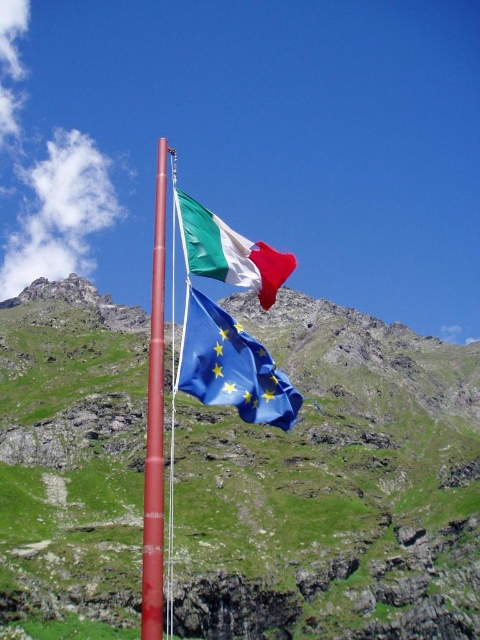
Question: Which point is closer to the camera?

Choices:
 (A) blue fabric flag at upper center
 (B) matte fabric flag at upper center
 (C) smooth red pole at center
 (D) green grassy mountain at upper center

Answer: (C)

Question: Is green grassy mountain at upper center closer to camera compared to smooth red pole at center?

Choices:
 (A) yes
 (B) no

Answer: (B)

Question: Which of these objects is positioned farthest from the smooth red pole at center?

Choices:
 (A) matte fabric flag at upper center
 (B) green grassy mountain at upper center

Answer: (B)

Question: Which point is closer to the camera?

Choices:
 (A) green grassy mountain at upper center
 (B) matte fabric flag at upper center
 (C) smooth red pole at center

Answer: (C)

Question: Does green grassy mountain at upper center appear on the left side of smooth red pole at center?

Choices:
 (A) no
 (B) yes

Answer: (A)

Question: Does blue fabric flag at upper center appear over smooth red pole at center?

Choices:
 (A) yes
 (B) no

Answer: (B)